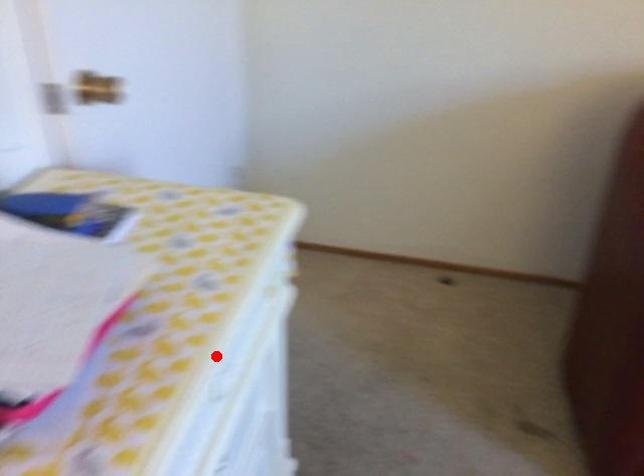
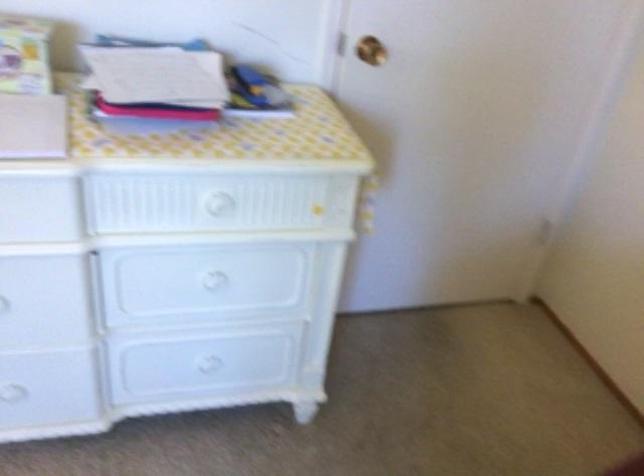
Question: I am providing you with two images of the same scene from different viewpoints. Given a red point in image1, look at the same physical point in image2. Is it:

Choices:
 (A) Closer to the viewpoint
 (B) Farther from the viewpoint

Answer: (B)